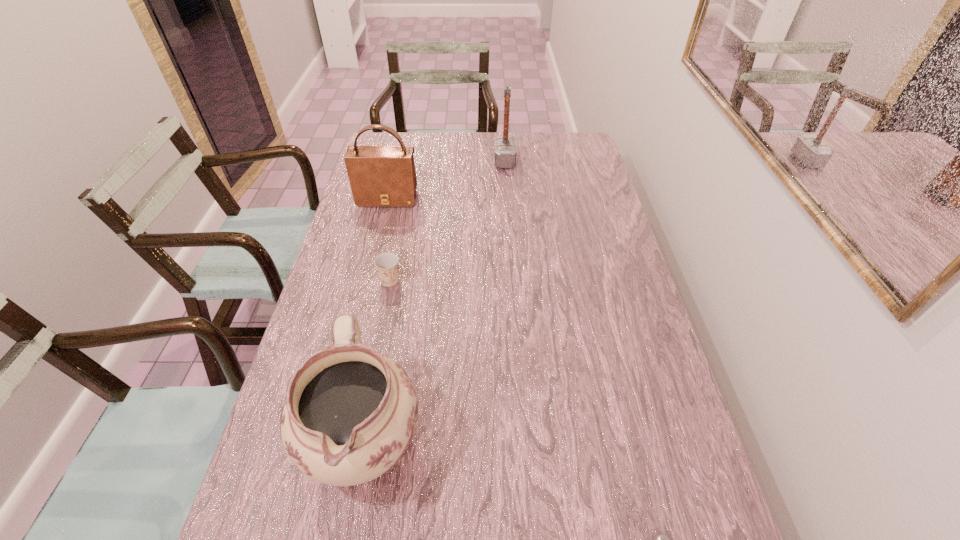
Locate an element on the screen. The height and width of the screenshot is (540, 960). vacant space situated on the right of the Dixie cup is located at coordinates (470, 280).

This screenshot has height=540, width=960. I want to click on object that is at the far edge, so click(505, 152).

Where is `shoulder bag at the left edge`? shoulder bag at the left edge is located at coordinates (380, 176).

I want to click on pitcher present at the left edge, so click(350, 413).

In order to click on Dixie cup that is at the left edge in this screenshot , I will do `click(386, 263)`.

I want to click on vacant space at the far edge, so click(534, 141).

The image size is (960, 540). I want to click on free space at the left edge of the desktop, so click(354, 212).

You are a GUI agent. You are given a task and a screenshot of the screen. Output one action in this format:
    pyautogui.click(x=<x>, y=<y>)
    Task: Click on the vacant region at the right edge of the desktop
    
    Given the screenshot: What is the action you would take?
    pyautogui.click(x=577, y=183)

The image size is (960, 540). Find the location of `vacant space at the far left corner of the desktop`. vacant space at the far left corner of the desktop is located at coordinates (389, 137).

Image resolution: width=960 pixels, height=540 pixels. Find the location of `empty space that is in between the farther hammer and the third farthest object`. empty space that is in between the farther hammer and the third farthest object is located at coordinates coord(447,221).